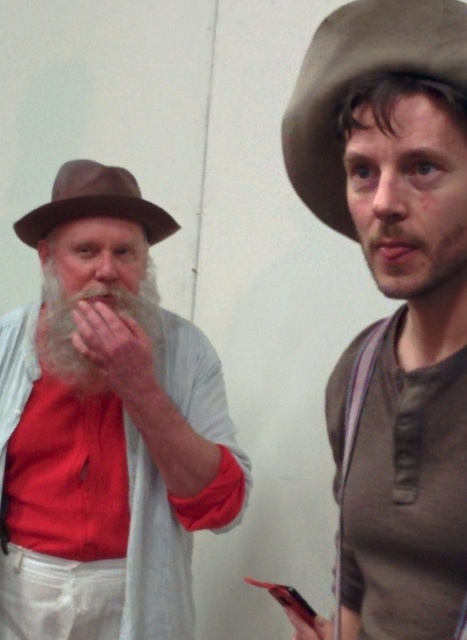
Based on the photo, you are an artist trying to sketch the scene. You notice the gray matte beard at right and the brown felt fedora at left. Which object is positioned lower in the image?

The gray matte beard at right is located below the brown felt fedora at left, so it is positioned lower in the image.

You are an artist trying to sketch this scene. You need to place the gray matte beard at right and the brown felt fedora at left correctly. Based on the scene description, which one should be positioned to the right side of the other?

The gray matte beard at right is to the right of the brown felt fedora at left, so in your sketch, place the gray matte beard at right to the right side of the brown felt fedora at left.

You are standing in the room and want to place a new poster on the wall between the two points, point [304,134] and point [389,266]. Which point should the poster be closer to if you want it to be closer to the older man?

The poster should be closer to point [389,266] because point [304,134] is behind point [389,266], meaning it is farther from the viewer. To be closer to the older man who is on the left, place it near point [389,266] which is in front and closer to the viewer.